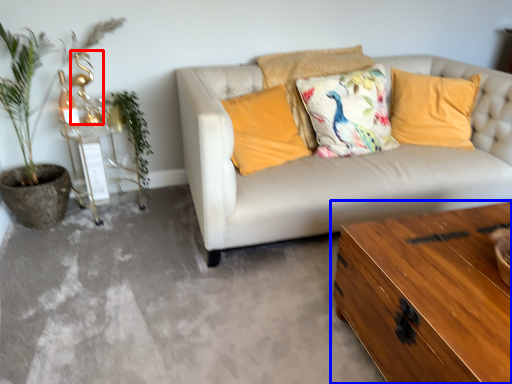
Question: Which object appears farthest to the camera in this image, table lamp (highlighted by a red box) or table (highlighted by a blue box)?

Choices:
 (A) table lamp
 (B) table

Answer: (A)